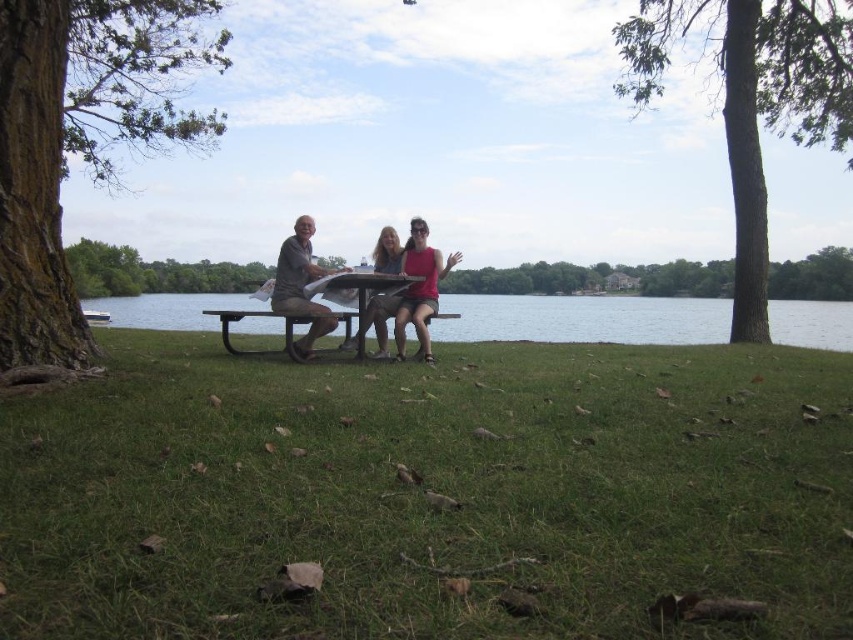
You are planning to take a photo of the metallic picnic table at center. To ensure the green rough bark tree at upper right appears in the background, where should you position yourself relative to the picnic table?

Position yourself in front of the metallic picnic table at center so that the green rough bark tree at upper right, which is located above it, will naturally be in the background of your photo.

You are standing at the picnic table and want to take a photo of the green rough bark tree at upper right. If your camera can focus on objects up to 30 feet away, will you be able to capture a clear photo of the tree?

Answer: The green rough bark tree at upper right is 31.98 feet away from the camera. Since the camera can only focus up to 30 feet, you won t be able to capture a clear photo of the tree.

Based on the photo, you are planning to take a photo of the matte pink tank top at center and the green rough bark tree at upper right from the lakeside. Which object should you focus on first if you want to capture both in the same frame without moving the camera?

You should focus on the matte pink tank top at center first because the green rough bark tree at upper right is wider, so positioning the narrower object first allows for better framing.